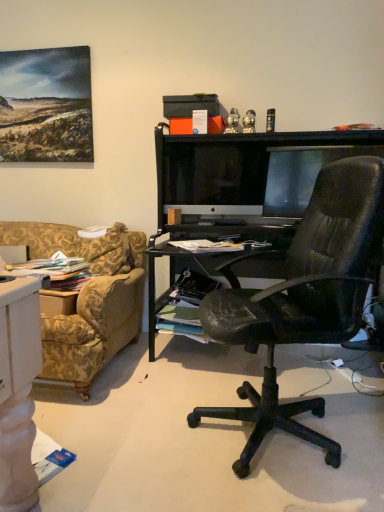
Question: Which direction should I rotate to face satin black monitor at center, acting as the 2th computer monitor starting from the right, — up or down?

Choices:
 (A) down
 (B) up

Answer: (B)

Question: From the image's perspective, is satin black monitor at center, acting as the 2th computer monitor starting from the right, below matte black monitor at center, acting as the 1th computer monitor starting from the right?

Choices:
 (A) yes
 (B) no

Answer: (B)

Question: Does satin black monitor at center, placed as the 1th computer monitor when sorted from left to right, have a lesser width compared to matte black monitor at center, acting as the 1th computer monitor starting from the right?

Choices:
 (A) yes
 (B) no

Answer: (B)

Question: Can you confirm if satin black monitor at center, acting as the 2th computer monitor starting from the right, is smaller than matte black monitor at center, which is the 2th computer monitor from left to right?

Choices:
 (A) no
 (B) yes

Answer: (A)

Question: Would you say matte black monitor at center, which is the 2th computer monitor from left to right, is part of satin black monitor at center, placed as the 1th computer monitor when sorted from left to right,'s contents?

Choices:
 (A) no
 (B) yes

Answer: (A)

Question: Is satin black monitor at center, acting as the 2th computer monitor starting from the right, in contact with matte black monitor at center, acting as the 1th computer monitor starting from the right?

Choices:
 (A) yes
 (B) no

Answer: (B)

Question: Are satin black monitor at center, placed as the 1th computer monitor when sorted from left to right, and matte black monitor at center, which is the 2th computer monitor from left to right, far apart?

Choices:
 (A) yes
 (B) no

Answer: (B)

Question: Considering the relative sizes of matte black monitor at center, acting as the 1th computer monitor starting from the right, and satin black monitor at center, placed as the 1th computer monitor when sorted from left to right, in the image provided, is matte black monitor at center, acting as the 1th computer monitor starting from the right, taller than satin black monitor at center, placed as the 1th computer monitor when sorted from left to right,?

Choices:
 (A) yes
 (B) no

Answer: (B)

Question: Is matte black monitor at center, which is the 2th computer monitor from left to right, behind satin black monitor at center, acting as the 2th computer monitor starting from the right?

Choices:
 (A) yes
 (B) no

Answer: (B)

Question: Can you confirm if matte black monitor at center, which is the 2th computer monitor from left to right, is bigger than satin black monitor at center, placed as the 1th computer monitor when sorted from left to right?

Choices:
 (A) yes
 (B) no

Answer: (B)

Question: Is matte black monitor at center, which is the 2th computer monitor from left to right, looking in the opposite direction of satin black monitor at center, placed as the 1th computer monitor when sorted from left to right?

Choices:
 (A) yes
 (B) no

Answer: (B)

Question: Is matte black monitor at center, acting as the 1th computer monitor starting from the right, at the right side of satin black monitor at center, placed as the 1th computer monitor when sorted from left to right?

Choices:
 (A) yes
 (B) no

Answer: (A)

Question: From a real-world perspective, is matte black monitor at center, acting as the 1th computer monitor starting from the right, on top of satin black monitor at center, acting as the 2th computer monitor starting from the right?

Choices:
 (A) yes
 (B) no

Answer: (B)

Question: Considering the relative positions of matte black monitor at center, acting as the 1th computer monitor starting from the right, and satin black monitor at center, placed as the 1th computer monitor when sorted from left to right, in the image provided, is matte black monitor at center, acting as the 1th computer monitor starting from the right, to the left or to the right of satin black monitor at center, placed as the 1th computer monitor when sorted from left to right,?

Choices:
 (A) right
 (B) left

Answer: (A)